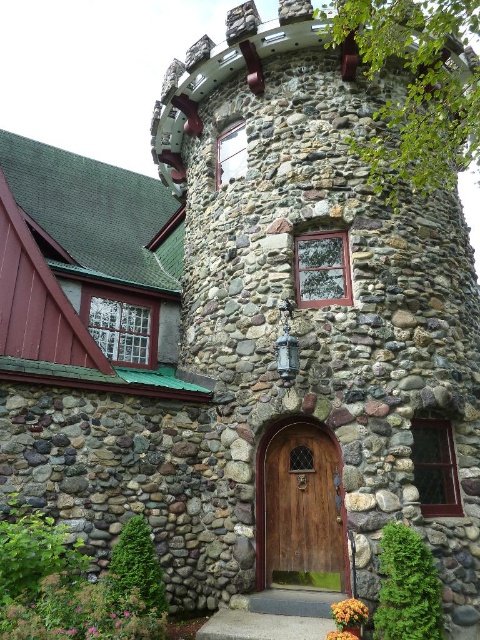
You are a visitor approaching the stone tower and notice the wooden door at center and the orange matte flower at lower center. Which object is bigger in size?

The wooden door at center is larger in size than the orange matte flower at lower center.

You are standing in front of the stone tower and want to enter through the wooden door at center. However, there is an orange matte flower at lower center blocking your path. Can you step around the flower to reach the door?

The wooden door at center is positioned over orange matte flower at lower center, meaning the door is directly above the flower. Since the flower is at the lower center and the door is above it, you can step to the side of the flower to reach the door as they are vertically aligned.